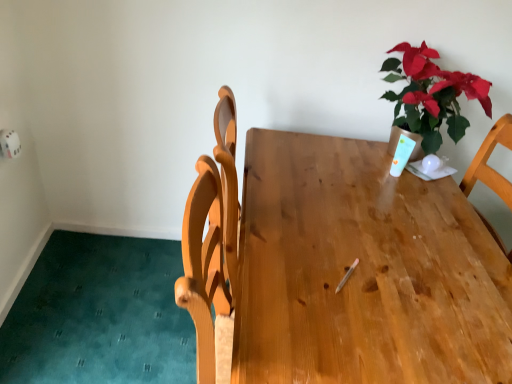
Question: Could green leafy plant at upper right be considered to be inside wooden table at center?

Choices:
 (A) yes
 (B) no

Answer: (B)

Question: Is wooden table at center not inside green leafy plant at upper right?

Choices:
 (A) yes
 (B) no

Answer: (A)

Question: From the image's perspective, would you say wooden table at center is positioned over green leafy plant at upper right?

Choices:
 (A) yes
 (B) no

Answer: (B)

Question: Is wooden table at center at the left side of green leafy plant at upper right?

Choices:
 (A) no
 (B) yes

Answer: (B)

Question: Is wooden table at center facing away from green leafy plant at upper right?

Choices:
 (A) no
 (B) yes

Answer: (A)

Question: Would you say wooden table at center is a long distance from green leafy plant at upper right?

Choices:
 (A) yes
 (B) no

Answer: (B)

Question: Can you confirm if green leafy plant at upper right is taller than wooden table at center?

Choices:
 (A) yes
 (B) no

Answer: (B)

Question: Is green leafy plant at upper right next to wooden table at center and touching it?

Choices:
 (A) no
 (B) yes

Answer: (A)

Question: From the image's perspective, does green leafy plant at upper right appear lower than wooden table at center?

Choices:
 (A) yes
 (B) no

Answer: (B)

Question: Is wooden table at center at the back of green leafy plant at upper right?

Choices:
 (A) no
 (B) yes

Answer: (A)

Question: Is green leafy plant at upper right positioned beyond the bounds of wooden table at center?

Choices:
 (A) no
 (B) yes

Answer: (B)

Question: Is green leafy plant at upper right positioned in front of wooden table at center?

Choices:
 (A) no
 (B) yes

Answer: (A)

Question: Which is correct: wooden table at center is inside green leafy plant at upper right, or outside of it?

Choices:
 (A) inside
 (B) outside

Answer: (B)